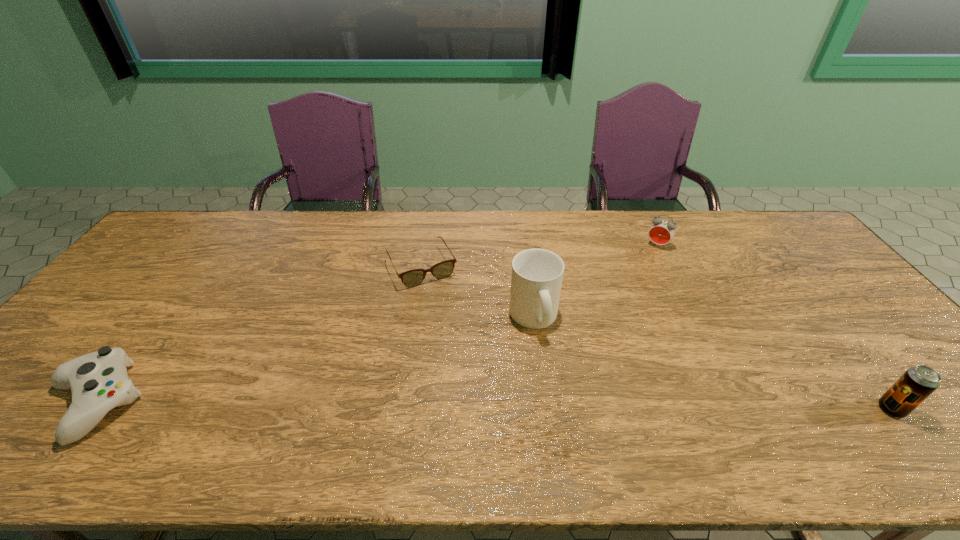
I want to click on vacant space located on the face of the second object from right to left, so click(x=640, y=269).

This screenshot has height=540, width=960. I want to click on free space located on the face of the second object from right to left, so click(x=619, y=300).

Locate an element on the screen. The width and height of the screenshot is (960, 540). free space located on the face of the second object from right to left is located at coordinates (639, 271).

Locate an element on the screen. free location located 0.290m at the front view of the fourth object from right to left is located at coordinates (472, 360).

At what (x,y) coordinates should I click in order to perform the action: click on vacant space located 0.110m at the front view of the fourth object from right to left. Please return your answer as a coordinate pair (x, y). The height and width of the screenshot is (540, 960). Looking at the image, I should click on (447, 313).

Where is `vacant space located at the front view of the fourth object from right to left`? vacant space located at the front view of the fourth object from right to left is located at coordinates (484, 381).

This screenshot has height=540, width=960. What are the coordinates of `vacant area located 0.100m on the handle side of the third object from right to left` in the screenshot? It's located at (563, 370).

Identify the location of vacant space located 0.200m on the handle side of the third object from right to left. This screenshot has height=540, width=960. (583, 403).

The image size is (960, 540). What are the coordinates of `free spot located on the handle side of the third object from right to left` in the screenshot? It's located at (x=559, y=363).

You are a GUI agent. You are given a task and a screenshot of the screen. Output one action in this format:
    pyautogui.click(x=<x>, y=<y>)
    Task: Click on the alarm clock at the far edge
    The image size is (960, 540).
    Given the screenshot: What is the action you would take?
    pyautogui.click(x=661, y=232)